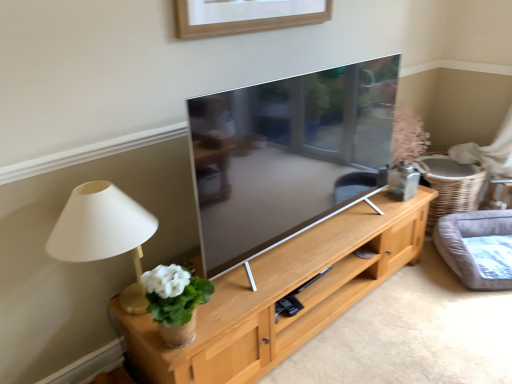
The image size is (512, 384). Identify the location of empty space that is ontop of light wood cabinet at center. (412, 315).